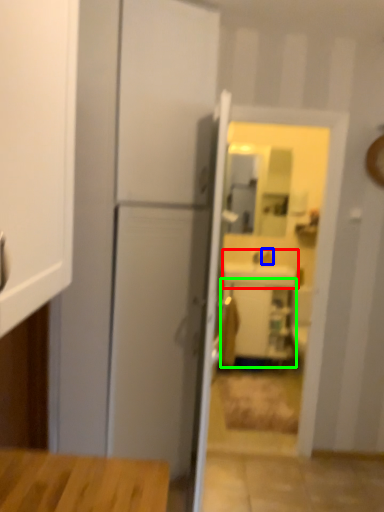
Question: Which object is positioned closest to sink (highlighted by a red box)? Select from faucet (highlighted by a blue box) and cabinetry (highlighted by a green box).

Choices:
 (A) faucet
 (B) cabinetry

Answer: (A)